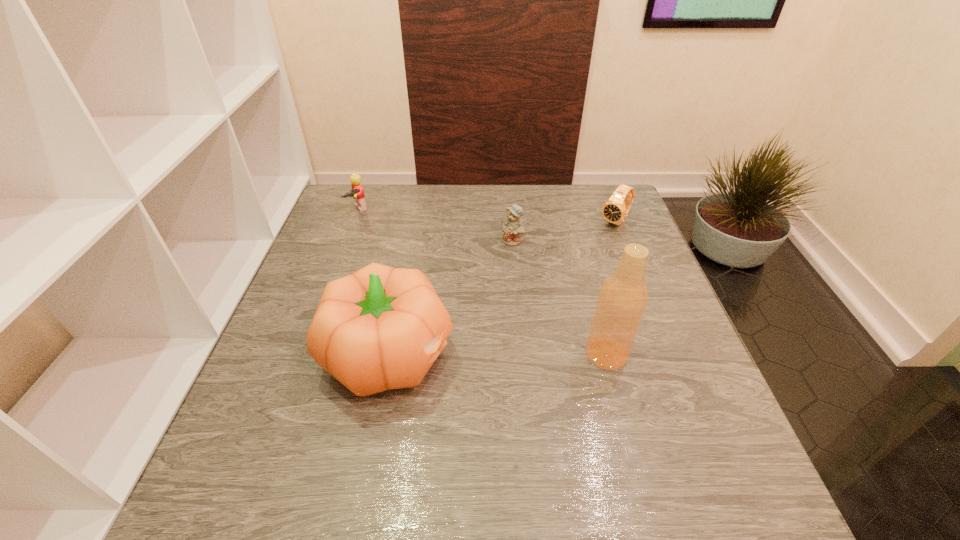
Where is `free spot on the desktop that is between the pumpkin and the second object from right to left and is positioned on the front-facing side of the third farthest object`? This screenshot has width=960, height=540. free spot on the desktop that is between the pumpkin and the second object from right to left and is positioned on the front-facing side of the third farthest object is located at coordinates (501, 354).

Find the location of a particular element. Image resolution: width=960 pixels, height=540 pixels. free space on the desktop that is between the pumpkin and the tallest object and is positioned in front of the Lego with the accessory visible is located at coordinates (499, 354).

Locate an element on the screen. free space on the desktop that is between the fourth object from right to left and the beer bottle and is positioned on the face of the rightmost object is located at coordinates (492, 354).